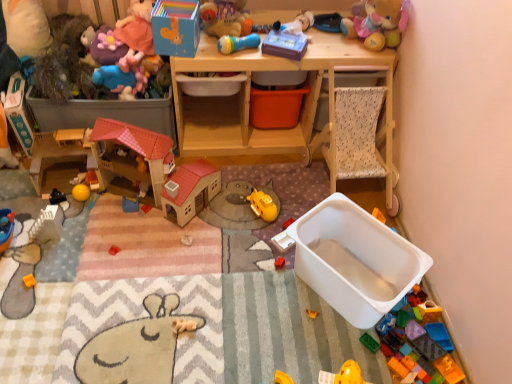
Where is `vacant area to the left of white plastic toy at center, arranged as the third toy when viewed from the right`? Image resolution: width=512 pixels, height=384 pixels. vacant area to the left of white plastic toy at center, arranged as the third toy when viewed from the right is located at coordinates (245, 242).